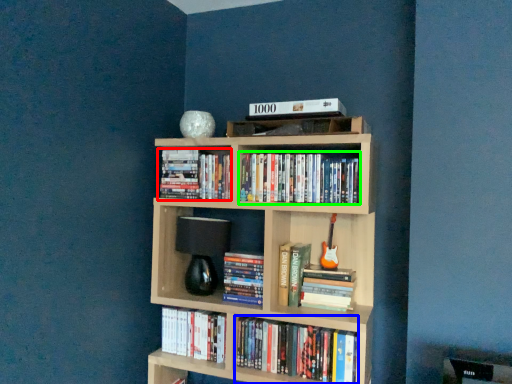
Question: Which is nearer to the book (highlighted by a red box)? book (highlighted by a blue box) or book (highlighted by a green box).

Choices:
 (A) book
 (B) book

Answer: (B)